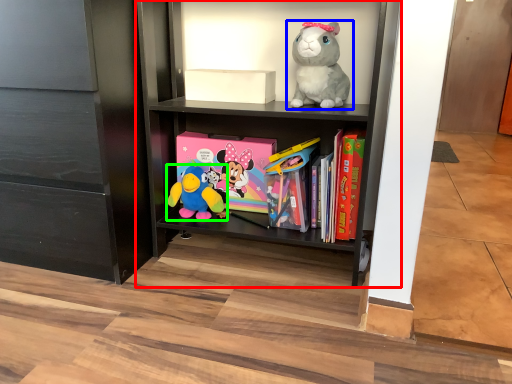
Question: Which is nearer to the shelf (highlighted by a red box)? toy (highlighted by a blue box) or toy (highlighted by a green box).

Choices:
 (A) toy
 (B) toy

Answer: (A)